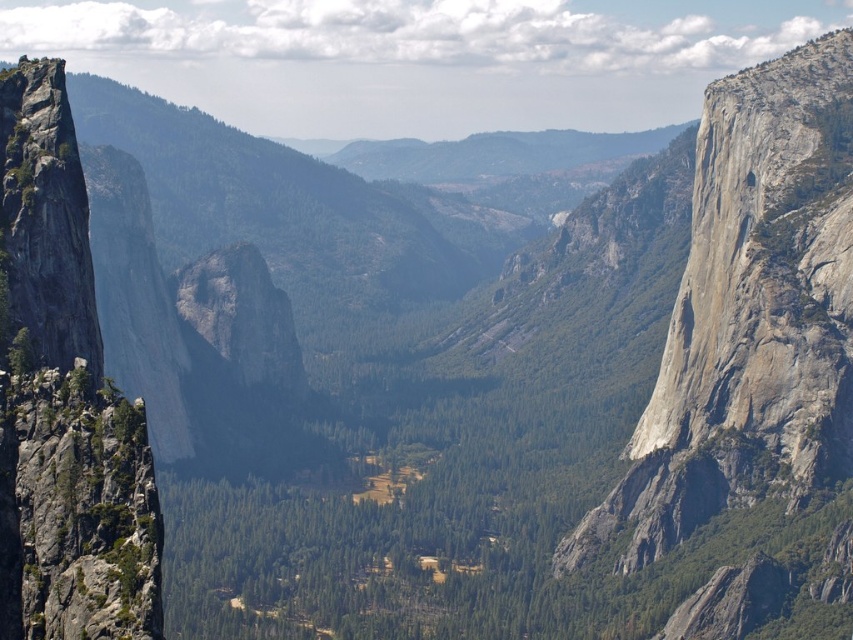
You are standing at the center of the valley and looking towards the mountains. You notice a specific point marked at coordinates point (749, 320). Based on the scene, what object does this point most likely represent?

The point (749, 320) corresponds to the gray rough rock at right.